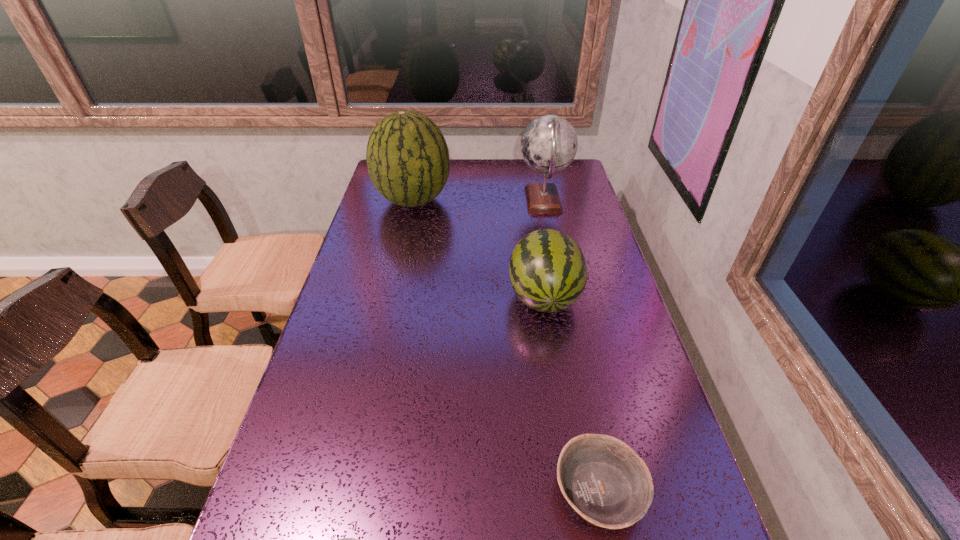
What are the coordinates of `unoccupied area between the globe and the left watermelon` in the screenshot? It's located at (478, 200).

Locate an element on the screen. free space between the farther watermelon and the shorter watermelon is located at coordinates (478, 248).

In order to click on free area in between the left watermelon and the globe in this screenshot , I will do `click(478, 200)`.

Select which object is the third closest to the pudding. Please provide its 2D coordinates. Your answer should be formatted as a tuple, i.e. [(x, y)], where the tuple contains the x and y coordinates of a point satisfying the conditions above.

[(407, 156)]

Select which object is the closest to the left watermelon. Please provide its 2D coordinates. Your answer should be formatted as a tuple, i.e. [(x, y)], where the tuple contains the x and y coordinates of a point satisfying the conditions above.

[(549, 143)]

Locate an element on the screen. vacant region that satisfies the following two spatial constraints: 1. at the equator of the globe; 2. at the stem end of the third shortest object is located at coordinates (563, 296).